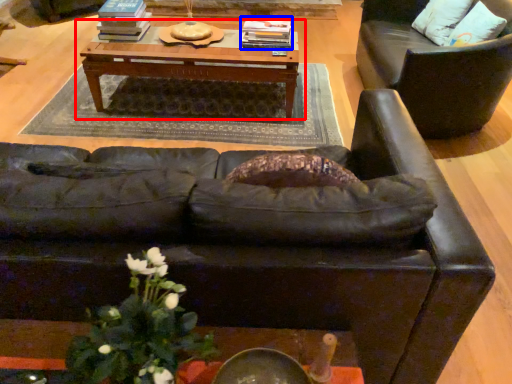
Question: Among these objects, which one is nearest to the camera, table (highlighted by a red box) or book (highlighted by a blue box)?

Choices:
 (A) table
 (B) book

Answer: (A)